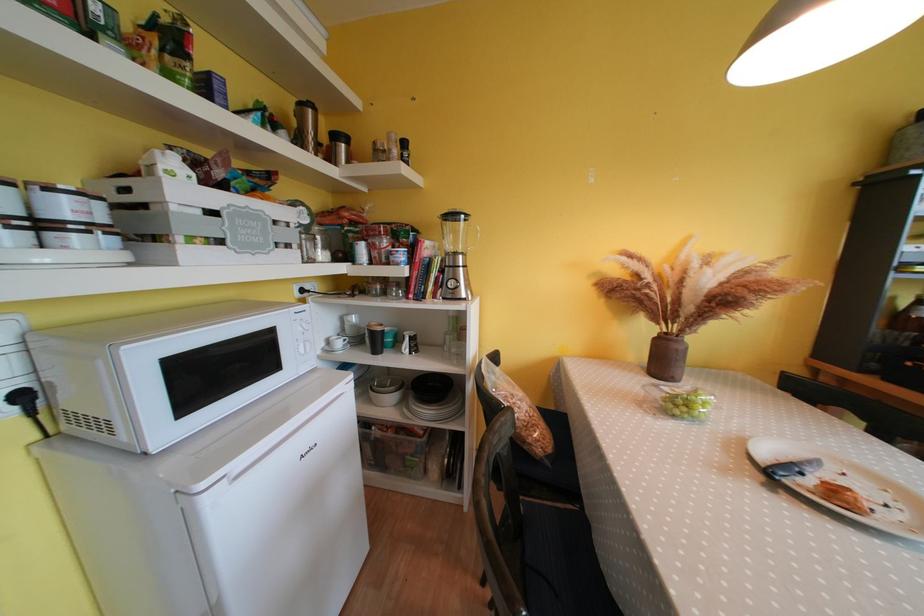
Image resolution: width=924 pixels, height=616 pixels. Describe the element at coordinates (556, 561) in the screenshot. I see `a chair sitting surface` at that location.